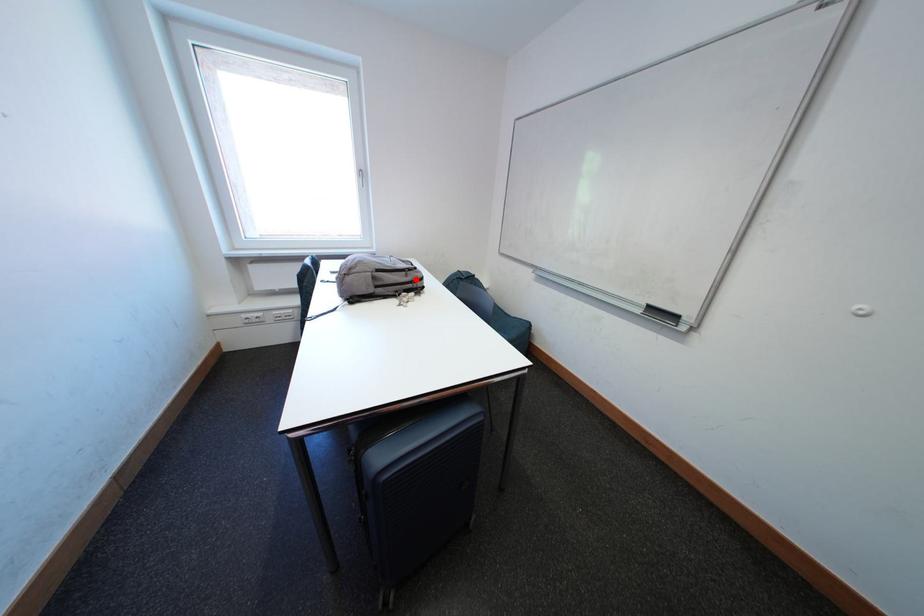
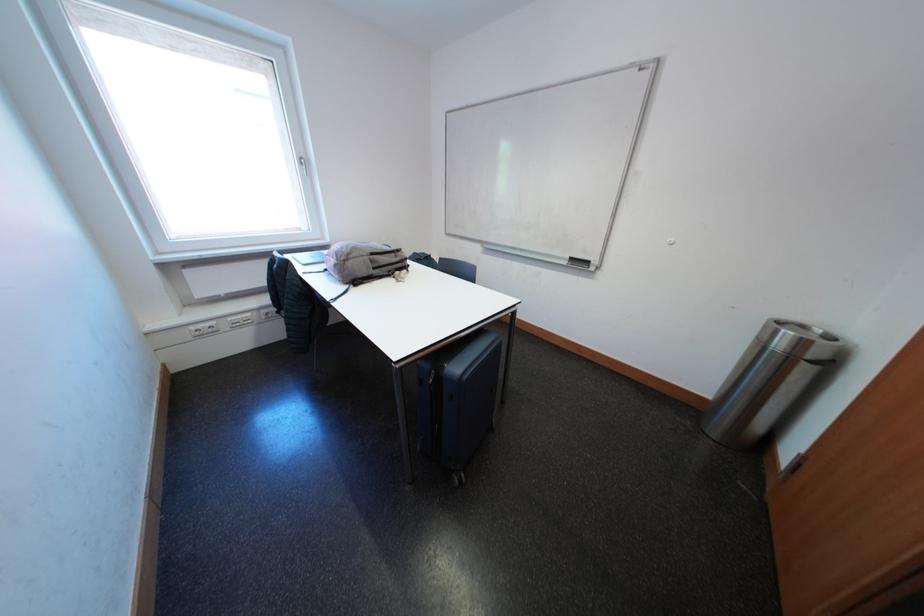
The point at the highlighted location is marked in the first image. Where is the corresponding point in the second image?

(406, 261)